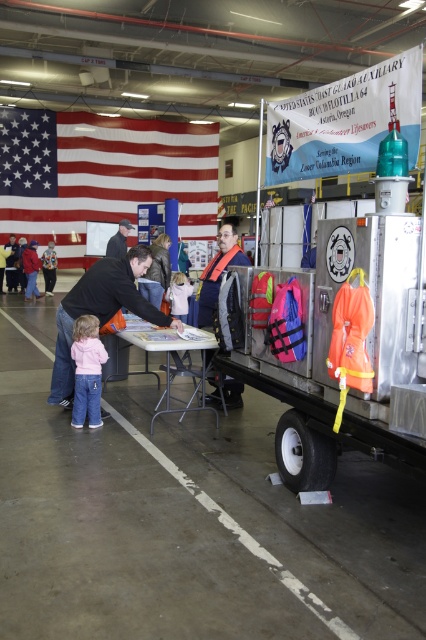
Question: Considering the real-world distances, which object is closest to the white fleece jacket at center?

Choices:
 (A) white banner at upper center
 (B) pink fleece jacket at lower left
 (C) american flag at upper left

Answer: (B)

Question: Estimate the real-world distances between objects in this image. Which object is closer to the pink fabric jacket at lower left?

Choices:
 (A) matte black shirt at left
 (B) white fleece jacket at center
 (C) blue fabric life vest at center
 (D) pink fleece jacket at lower left

Answer: (B)

Question: Can you confirm if matte black shirt at left is positioned to the left of pink fabric jacket at lower left?

Choices:
 (A) no
 (B) yes

Answer: (A)

Question: Is white banner at upper center closer to camera compared to pink fabric jacket at lower left?

Choices:
 (A) yes
 (B) no

Answer: (A)

Question: Which of the following is the closest to the observer?

Choices:
 (A) (55, 401)
 (B) (181, 296)
 (C) (51, 241)

Answer: (A)

Question: Is white banner at upper center to the left of white fleece jacket at center from the viewer's perspective?

Choices:
 (A) no
 (B) yes

Answer: (A)